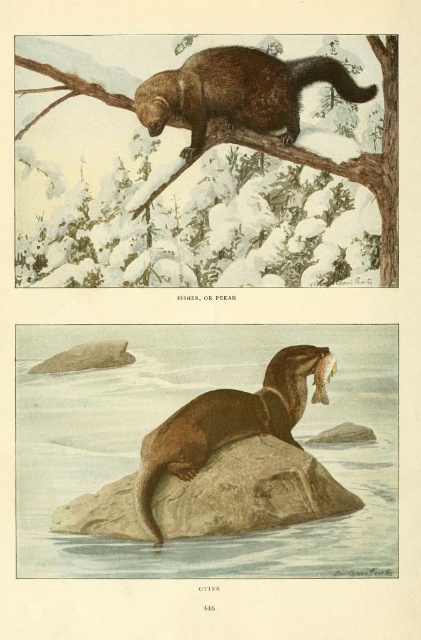
Question: Is brown furry beaver at upper center smaller than brown furry beaver at center?

Choices:
 (A) yes
 (B) no

Answer: (A)

Question: Where is brown glossy water at center located in relation to brown rock at center in the image?

Choices:
 (A) right
 (B) left

Answer: (A)

Question: Which point is closer to the camera?

Choices:
 (A) (157, 77)
 (B) (76, 352)
 (C) (272, 144)
 (D) (194, 406)

Answer: (D)

Question: Which point is farther to the camera?

Choices:
 (A) brown rock at center
 (B) smooth gray rock at center
 (C) brown furry beaver at upper center

Answer: (C)

Question: Estimate the real-world distances between objects in this image. Which object is closer to the smooth gray rock at center?

Choices:
 (A) brown furry beaver at center
 (B) brown rock at center
 (C) brown glossy water at center

Answer: (C)

Question: Is brown furry beaver at upper center wider than smooth brown fur at upper center?

Choices:
 (A) no
 (B) yes

Answer: (A)